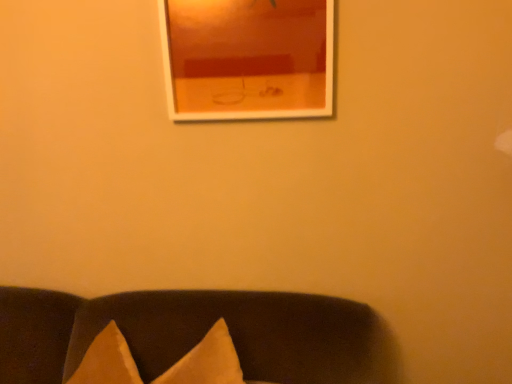
Question: In terms of width, does matte fabric cushions at lower center look wider or thinner when compared to white glossy picture frame at upper center?

Choices:
 (A) thin
 (B) wide

Answer: (B)

Question: Is matte fabric cushions at lower center to the left or to the right of white glossy picture frame at upper center in the image?

Choices:
 (A) right
 (B) left

Answer: (B)

Question: From the image's perspective, is matte fabric cushions at lower center positioned above or below white glossy picture frame at upper center?

Choices:
 (A) below
 (B) above

Answer: (A)

Question: In terms of width, does white glossy picture frame at upper center look wider or thinner when compared to matte fabric cushions at lower center?

Choices:
 (A) thin
 (B) wide

Answer: (A)

Question: Is white glossy picture frame at upper center bigger or smaller than matte fabric cushions at lower center?

Choices:
 (A) big
 (B) small

Answer: (B)

Question: Is white glossy picture frame at upper center in front of or behind matte fabric cushions at lower center in the image?

Choices:
 (A) front
 (B) behind

Answer: (B)

Question: Would you say white glossy picture frame at upper center is to the left or to the right of matte fabric cushions at lower center in the picture?

Choices:
 (A) left
 (B) right

Answer: (B)